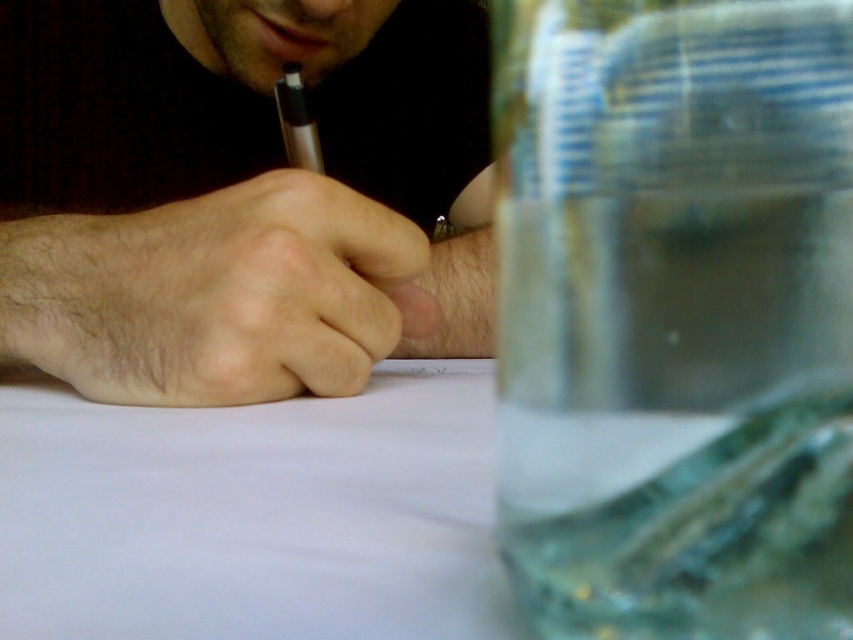
Question: Which of the following is the farthest from the observer?

Choices:
 (A) metallic gold pencil at center
 (B) white paper at center
 (C) smooth skin hand at center
 (D) transparent plastic jar at right

Answer: (A)

Question: Is transparent plastic jar at right positioned in front of metallic gold pencil at center?

Choices:
 (A) no
 (B) yes

Answer: (B)

Question: Which point is farther to the camera?

Choices:
 (A) (368, 340)
 (B) (262, 406)

Answer: (A)

Question: Where is white paper at center located in relation to metallic gold pencil at center in the image?

Choices:
 (A) left
 (B) right

Answer: (B)

Question: Which point appears farthest from the camera in this image?

Choices:
 (A) (289, 163)
 (B) (76, 205)

Answer: (A)

Question: Can you confirm if white paper at center is positioned to the right of metallic gold pencil at center?

Choices:
 (A) no
 (B) yes

Answer: (B)